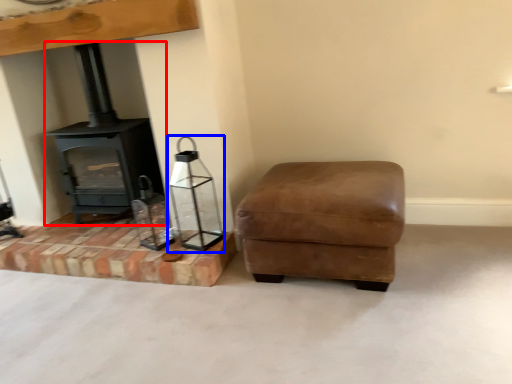
Question: Which object is further to the camera taking this photo, wood burning stove (highlighted by a red box) or candle holder (highlighted by a blue box)?

Choices:
 (A) wood burning stove
 (B) candle holder

Answer: (A)